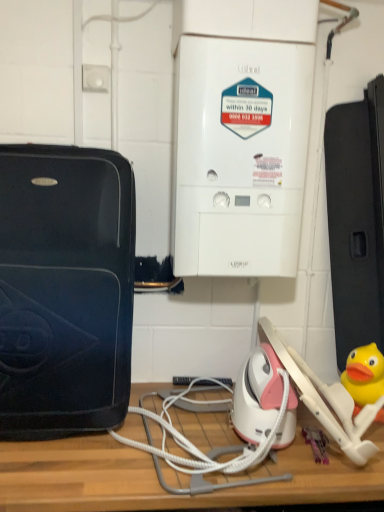
This screenshot has height=512, width=384. I want to click on vacant space in front of matte black suitcase at left, marked as the second home appliance in a right-to-left arrangement, so click(x=56, y=472).